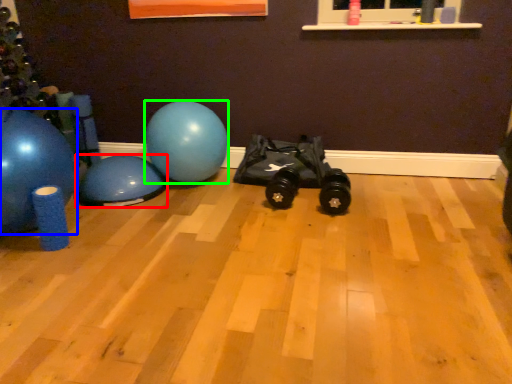
Question: Which is nearer to the ball (highlighted by a red box)? ball (highlighted by a blue box) or ball (highlighted by a green box).

Choices:
 (A) ball
 (B) ball

Answer: (B)